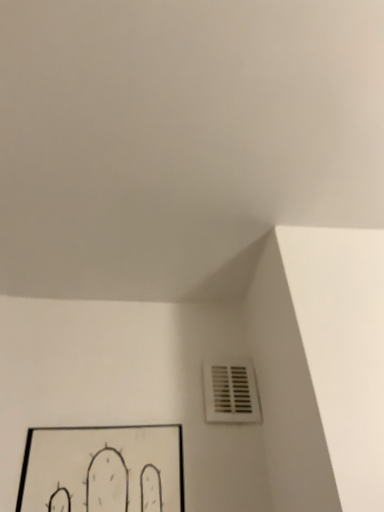
What do you see at coordinates (231, 392) in the screenshot?
I see `white plastic vent at lower right` at bounding box center [231, 392].

Where is `white plastic vent at lower right`? white plastic vent at lower right is located at coordinates (231, 392).

The width and height of the screenshot is (384, 512). I want to click on white plastic vent at lower right, so click(231, 392).